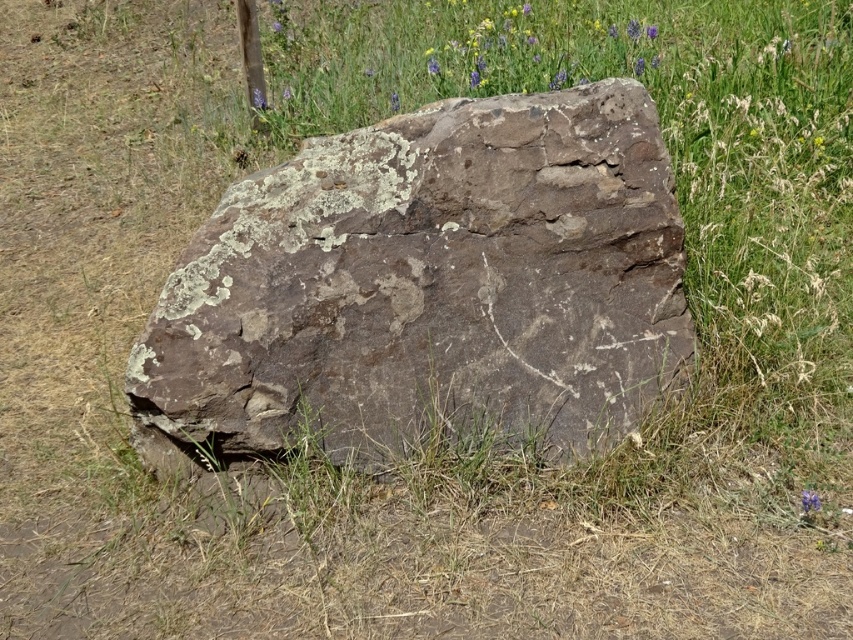
Measure the distance from brown rough rock at center to blue textured flowers at upper center.

brown rough rock at center and blue textured flowers at upper center are 7.09 feet apart from each other.

Which is in front, point (306, 214) or point (467, 88)?

Point (306, 214)

This screenshot has width=853, height=640. Find the location of `brown rough rock at center`. brown rough rock at center is located at coordinates (427, 285).

Find the location of `brown rough rock at center`. brown rough rock at center is located at coordinates (427, 285).